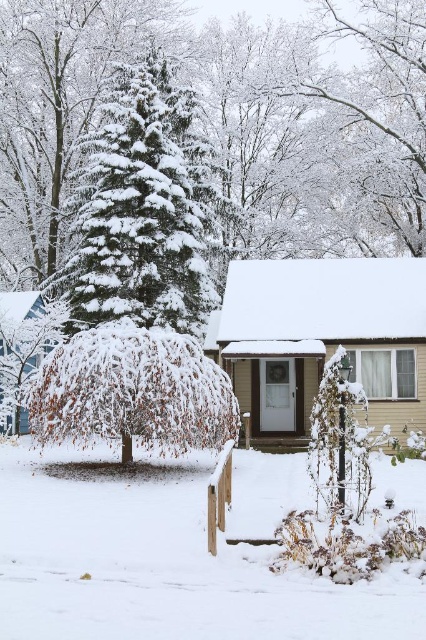
You are standing in the winter scene and want to locate the white frosty branches at upper center. According to the coordinates provided, where exactly should you look?

The white frosty branches at upper center are located at point coordinates of 0.180 on the x axis and 0.878 on the y axis.

From the picture: You are a bird looking for a place to land in the winter scene. Which object would you choose between the white fluffy snow at lower center and the white frosty branches at upper center, and why?

The bird should choose the white frosty branches at upper center because the white fluffy snow at lower center is shorter than the white frosty branches at upper center, making the branches a higher and possibly more stable landing spot.